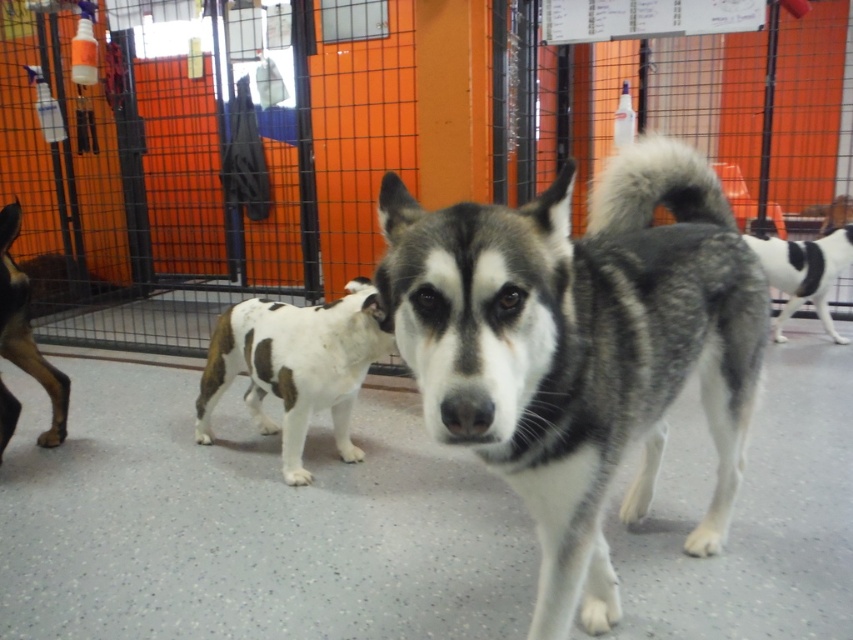
Question: Does brown fur dog at left have a greater width compared to white and black fur at center?

Choices:
 (A) no
 (B) yes

Answer: (A)

Question: Does spotted fur dog at center lie in front of brown fur dog at left?

Choices:
 (A) yes
 (B) no

Answer: (A)

Question: Is the position of gray-white fur dog at center less distant than that of white and black fur at center?

Choices:
 (A) yes
 (B) no

Answer: (A)

Question: Which object is farther from the camera taking this photo?

Choices:
 (A) brown fur dog at left
 (B) white and black fur at center

Answer: (B)

Question: Which point appears closest to the camera in this image?

Choices:
 (A) (248, 339)
 (B) (751, 259)
 (C) (10, 406)

Answer: (B)

Question: Which of the following is the farthest from the observer?

Choices:
 (A) (25, 371)
 (B) (294, 310)
 (C) (772, 243)

Answer: (C)